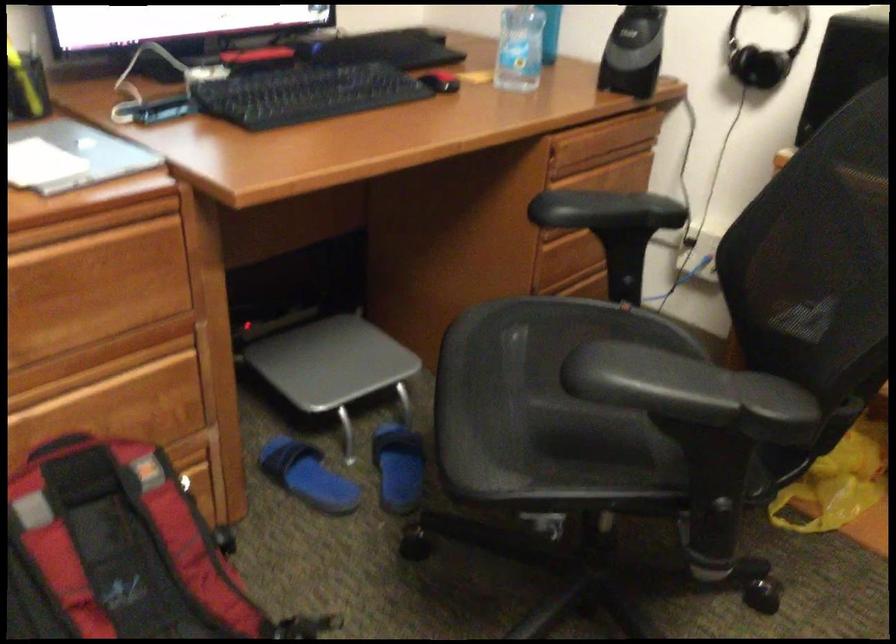
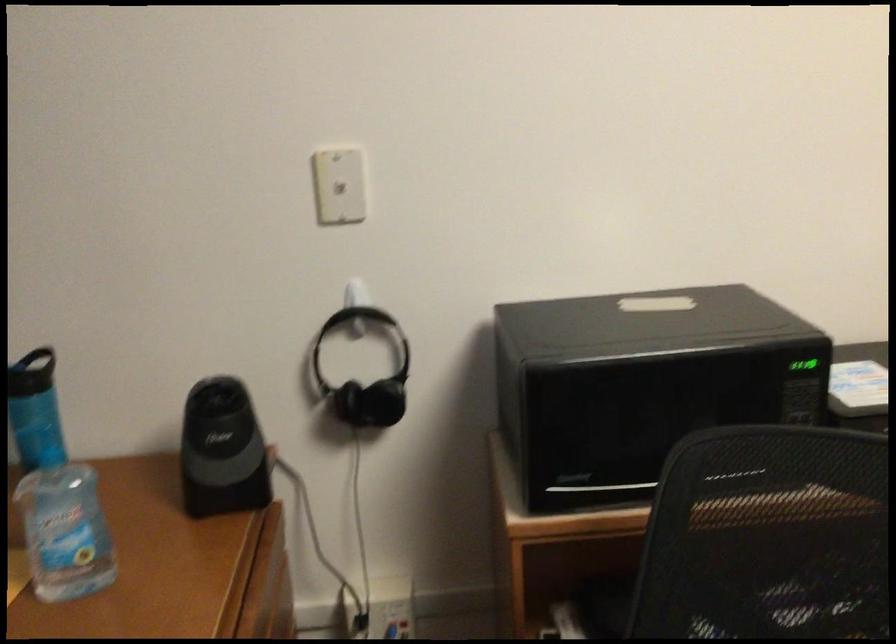
Question: How did the camera likely rotate?

Choices:
 (A) Left
 (B) Right
 (C) Up
 (D) Down

Answer: (B)